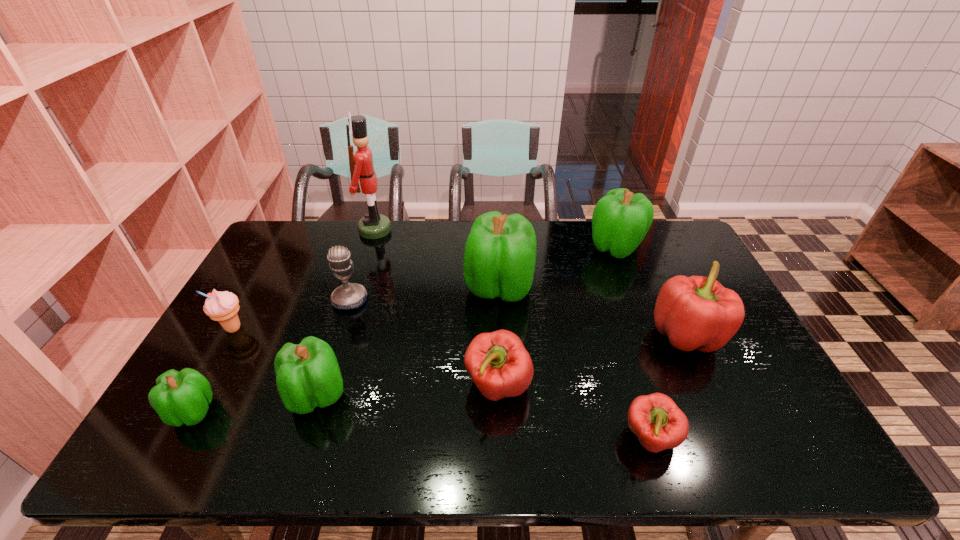
Identify the location of object that is at the near left corner. This screenshot has height=540, width=960. (183, 397).

The width and height of the screenshot is (960, 540). In order to click on vacant space at the far edge in this screenshot , I will do `click(443, 228)`.

The width and height of the screenshot is (960, 540). In the image, there is a desktop. Identify the location of vacant space at the near edge. (385, 433).

Find the location of `free region at the left edge of the desktop`. free region at the left edge of the desktop is located at coordinates (276, 319).

You are a GUI agent. You are given a task and a screenshot of the screen. Output one action in this format:
    pyautogui.click(x=<x>, y=<y>)
    Task: Click on the blank area at the right edge
    This screenshot has width=960, height=540.
    Given the screenshot: What is the action you would take?
    pyautogui.click(x=734, y=383)

Locate an element on the screen. Image resolution: width=960 pixels, height=540 pixels. vacant space at the far left corner is located at coordinates (313, 234).

In the image, there is a desktop. At what (x,y) coordinates should I click in order to perform the action: click on vacant area at the far right corner. Please return your answer as a coordinate pair (x, y). The width and height of the screenshot is (960, 540). Looking at the image, I should click on (676, 232).

The image size is (960, 540). I want to click on free region at the near right corner of the desktop, so click(780, 441).

Identify the location of free space between the leftmost pink bell pepper and the tallest object. (437, 308).

This screenshot has height=540, width=960. What are the coordinates of `free space between the sixth bell pepper from right to left and the second biggest pink bell pepper` in the screenshot? It's located at (407, 390).